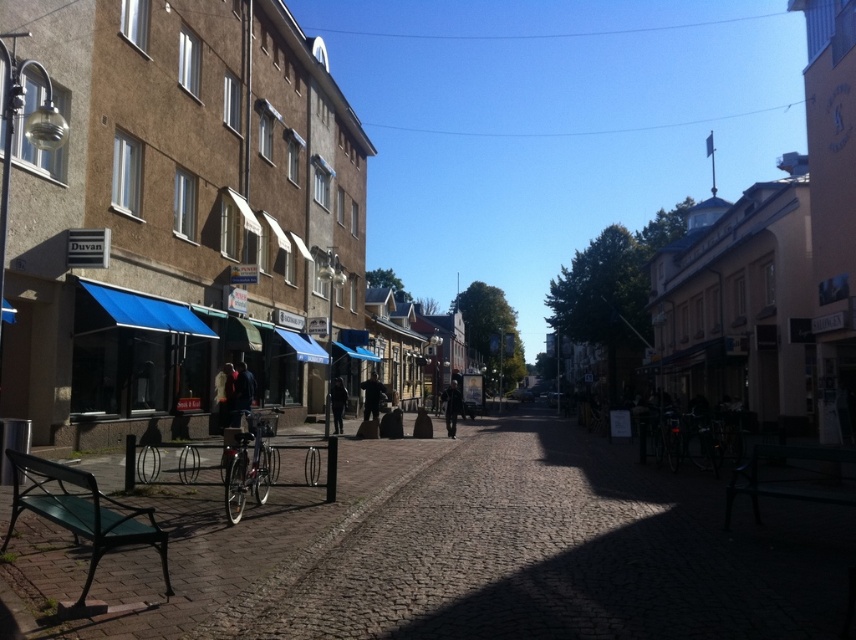
You are a delivery person standing at the start of the street. You need to deliver a package to the building with the sign reading Duvan. The black matte jacket at center is blocking your path. Can you go around it by moving to the left or right side of the street?

The black matte jacket at center is located at point (450, 406). Since the Duvan building is on the left side of the street, you can move to the right side of the street to go around the jacket and reach the Duvan building.

You are a tailor measuring jackets for a customer. You have two jackets in front of you on the street scene described. Which jacket has a smaller width, the dark blue jacket at center or the dark brown leather jacket at center?

The dark blue jacket at center has a smaller width than the dark brown leather jacket at center according to the description.

You are a delivery person carrying a large package that is 1.2 meters wide. You are standing in the middle of the street and see the black matte jacket at center and dark blue jeans at center. Can you pass between them without moving either object?

The black matte jacket at center might be wider than dark blue jeans at center, but since the exact width isn t specified, it s uncertain if the 1.2 meter package can pass through safely. You should check the actual space between them before attempting to move the package.